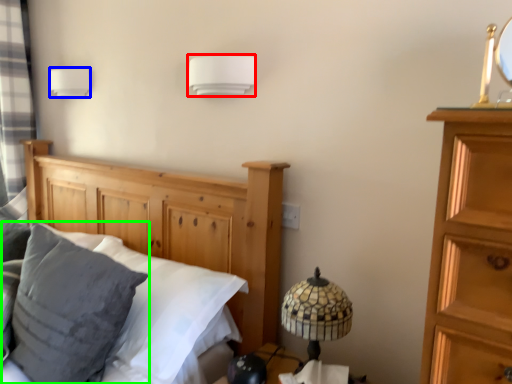
Question: Which object is positioned closest to lamp (highlighted by a red box)? Select from lamp (highlighted by a blue box) and pillow (highlighted by a green box).

Choices:
 (A) lamp
 (B) pillow

Answer: (B)